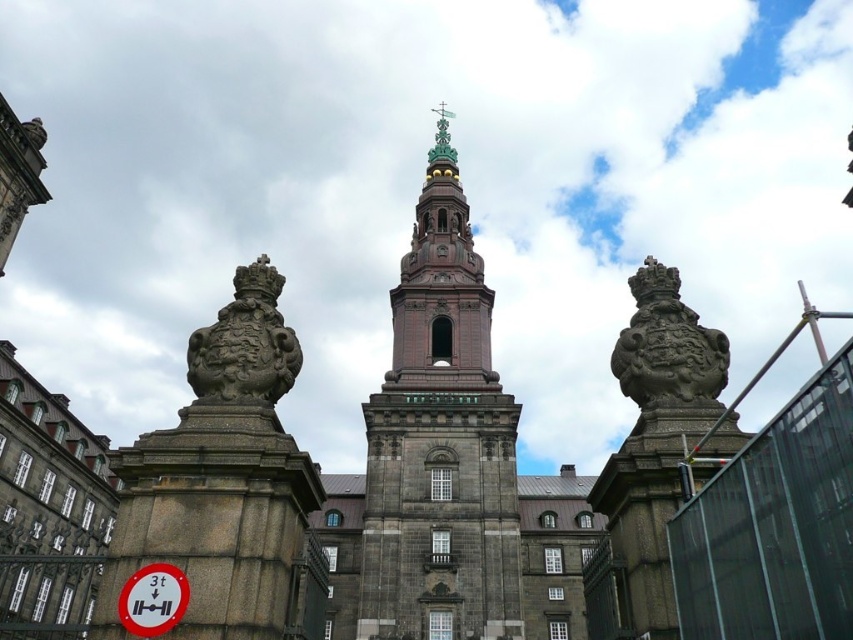
You are a visitor approaching the cathedral entrance. You see the gray stone sculpture at center and the white plastic sign at lower left. Which object is taller?

The gray stone sculpture at center is taller than the white plastic sign at lower left.

You are an architect assessing the symmetry of the entranceway. The two pillars have a gray stone sculpture at center and a stone carved emblem at center. Which object is bigger?

The gray stone sculpture at center is larger in size than the stone carved emblem at center.